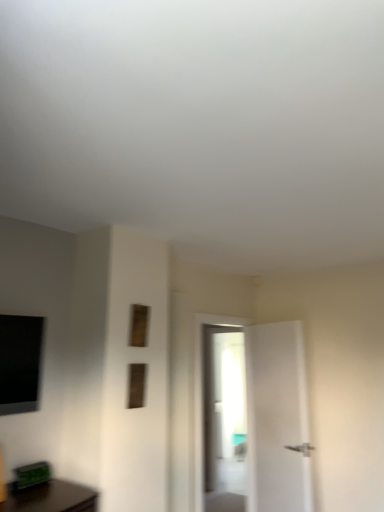
Consider the image. What is the approximate width of wooden frame at center, the 2th window in the top-to-bottom sequence?

wooden frame at center, the 2th window in the top-to-bottom sequence, is 1.12 inches in width.

What are the coordinates of `wooden frame at center, which appears as the 1th window when ordered from the bottom` in the screenshot? It's located at (136, 385).

The width and height of the screenshot is (384, 512). What do you see at coordinates (136, 385) in the screenshot?
I see `wooden frame at center, which appears as the 1th window when ordered from the bottom` at bounding box center [136, 385].

Locate an element on the screen. The image size is (384, 512). wooden frame at upper center, which is the first window from top to bottom is located at coordinates (139, 325).

The height and width of the screenshot is (512, 384). What do you see at coordinates (139, 325) in the screenshot?
I see `wooden frame at upper center, which is the first window from top to bottom` at bounding box center [139, 325].

Where is `wooden frame at center, the 2th window in the top-to-bottom sequence`? Image resolution: width=384 pixels, height=512 pixels. wooden frame at center, the 2th window in the top-to-bottom sequence is located at coordinates (136, 385).

Can you confirm if wooden frame at upper center, which ranks as the 2th window in bottom-to-top order, is positioned to the right of wooden frame at center, which appears as the 1th window when ordered from the bottom?

Incorrect, wooden frame at upper center, which ranks as the 2th window in bottom-to-top order, is not on the right side of wooden frame at center, which appears as the 1th window when ordered from the bottom.

Considering the positions of objects wooden frame at upper center, which ranks as the 2th window in bottom-to-top order, and wooden frame at center, which appears as the 1th window when ordered from the bottom, in the image provided, who is behind, wooden frame at upper center, which ranks as the 2th window in bottom-to-top order, or wooden frame at center, which appears as the 1th window when ordered from the bottom,?

wooden frame at upper center, which ranks as the 2th window in bottom-to-top order, is further away from the camera.

Does point (142, 309) appear closer or farther from the camera than point (130, 401)?

Point (142, 309) appears to be farther away from the viewer than point (130, 401).

From the image's perspective, relative to wooden frame at center, which appears as the 1th window when ordered from the bottom, is wooden frame at upper center, which ranks as the 2th window in bottom-to-top order, above or below?

wooden frame at upper center, which ranks as the 2th window in bottom-to-top order, is situated higher than wooden frame at center, which appears as the 1th window when ordered from the bottom, in the image.

In the scene shown: From a real-world perspective, is wooden frame at upper center, which is the first window from top to bottom, under wooden frame at center, which appears as the 1th window when ordered from the bottom?

No, from a real-world perspective, wooden frame at upper center, which is the first window from top to bottom, is not under wooden frame at center, which appears as the 1th window when ordered from the bottom.

Does wooden frame at upper center, which is the first window from top to bottom, have a greater width compared to wooden frame at center, the 2th window in the top-to-bottom sequence?

In fact, wooden frame at upper center, which is the first window from top to bottom, might be narrower than wooden frame at center, the 2th window in the top-to-bottom sequence.

Can you confirm if wooden frame at upper center, which ranks as the 2th window in bottom-to-top order, is shorter than wooden frame at center, which appears as the 1th window when ordered from the bottom?

Correct, wooden frame at upper center, which ranks as the 2th window in bottom-to-top order, is not as tall as wooden frame at center, which appears as the 1th window when ordered from the bottom.

Looking at this image, considering the relative sizes of wooden frame at upper center, which is the first window from top to bottom, and wooden frame at center, the 2th window in the top-to-bottom sequence, in the image provided, is wooden frame at upper center, which is the first window from top to bottom, smaller than wooden frame at center, the 2th window in the top-to-bottom sequence,?

Yes.

Is wooden frame at center, the 2th window in the top-to-bottom sequence, surrounded by wooden frame at upper center, which is the first window from top to bottom?

That's incorrect, wooden frame at center, the 2th window in the top-to-bottom sequence, is not inside wooden frame at upper center, which is the first window from top to bottom.

Looking at this image, is wooden frame at upper center, which ranks as the 2th window in bottom-to-top order, not close to wooden frame at center, which appears as the 1th window when ordered from the bottom?

wooden frame at upper center, which ranks as the 2th window in bottom-to-top order, is actually quite close to wooden frame at center, which appears as the 1th window when ordered from the bottom.

Is wooden frame at upper center, which is the first window from top to bottom, aimed at wooden frame at center, the 2th window in the top-to-bottom sequence?

No, wooden frame at upper center, which is the first window from top to bottom, is not turned towards wooden frame at center, the 2th window in the top-to-bottom sequence.

What's the angular difference between wooden frame at upper center, which ranks as the 2th window in bottom-to-top order, and wooden frame at center, the 2th window in the top-to-bottom sequence,'s facing directions?

There is a 4.23-degree angle between the facing directions of wooden frame at upper center, which ranks as the 2th window in bottom-to-top order, and wooden frame at center, the 2th window in the top-to-bottom sequence.

How far apart are wooden frame at upper center, which ranks as the 2th window in bottom-to-top order, and wooden frame at center, the 2th window in the top-to-bottom sequence?

8.94 inches.

Identify the location of window behind the wooden frame at center, the 2th window in the top-to-bottom sequence. The image size is (384, 512). (139, 325).

Based on their positions, is wooden frame at center, the 2th window in the top-to-bottom sequence, located to the left or right of wooden frame at upper center, which ranks as the 2th window in bottom-to-top order?

wooden frame at center, the 2th window in the top-to-bottom sequence, is to the right of wooden frame at upper center, which ranks as the 2th window in bottom-to-top order.

Which object is closer to the camera taking this photo, wooden frame at center, which appears as the 1th window when ordered from the bottom, or wooden frame at upper center, which ranks as the 2th window in bottom-to-top order?

wooden frame at center, which appears as the 1th window when ordered from the bottom, is more forward.

Is point (141, 369) positioned in front of point (132, 332)?

No, (141, 369) is behind (132, 332).

From the image's perspective, is wooden frame at center, the 2th window in the top-to-bottom sequence, located above or below wooden frame at upper center, which ranks as the 2th window in bottom-to-top order?

From the image's perspective, wooden frame at center, the 2th window in the top-to-bottom sequence, appears below wooden frame at upper center, which ranks as the 2th window in bottom-to-top order.

From a real-world perspective, is wooden frame at center, the 2th window in the top-to-bottom sequence, physically above wooden frame at upper center, which is the first window from top to bottom?

No, from a real-world perspective, wooden frame at center, the 2th window in the top-to-bottom sequence, is not on top of wooden frame at upper center, which is the first window from top to bottom.

Considering the relative sizes of wooden frame at center, which appears as the 1th window when ordered from the bottom, and wooden frame at upper center, which ranks as the 2th window in bottom-to-top order, in the image provided, is wooden frame at center, which appears as the 1th window when ordered from the bottom, thinner than wooden frame at upper center, which ranks as the 2th window in bottom-to-top order,?

In fact, wooden frame at center, which appears as the 1th window when ordered from the bottom, might be wider than wooden frame at upper center, which ranks as the 2th window in bottom-to-top order.

Does wooden frame at center, which appears as the 1th window when ordered from the bottom, have a lesser height compared to wooden frame at upper center, which is the first window from top to bottom?

No, wooden frame at center, which appears as the 1th window when ordered from the bottom, is not shorter than wooden frame at upper center, which is the first window from top to bottom.

Between wooden frame at center, the 2th window in the top-to-bottom sequence, and wooden frame at upper center, which is the first window from top to bottom, which one has smaller size?

wooden frame at upper center, which is the first window from top to bottom.

Is wooden frame at upper center, which is the first window from top to bottom, completely or partially inside wooden frame at center, the 2th window in the top-to-bottom sequence?

Definitely not — wooden frame at upper center, which is the first window from top to bottom, is not inside wooden frame at center, the 2th window in the top-to-bottom sequence.

Based on the photo, is wooden frame at center, the 2th window in the top-to-bottom sequence, with wooden frame at upper center, which is the first window from top to bottom?

There is a gap between wooden frame at center, the 2th window in the top-to-bottom sequence, and wooden frame at upper center, which is the first window from top to bottom.

Is wooden frame at center, the 2th window in the top-to-bottom sequence, aimed at wooden frame at upper center, which ranks as the 2th window in bottom-to-top order?

No, wooden frame at center, the 2th window in the top-to-bottom sequence, is not facing towards wooden frame at upper center, which ranks as the 2th window in bottom-to-top order.

How different are the orientations of wooden frame at center, which appears as the 1th window when ordered from the bottom, and wooden frame at upper center, which ranks as the 2th window in bottom-to-top order, in degrees?

wooden frame at center, which appears as the 1th window when ordered from the bottom, and wooden frame at upper center, which ranks as the 2th window in bottom-to-top order, are facing 4.23 degrees away from each other.

Locate an element on the screen. Image resolution: width=384 pixels, height=512 pixels. window in front of the wooden frame at upper center, which is the first window from top to bottom is located at coordinates (136, 385).

The image size is (384, 512). Identify the location of window located in front of the wooden frame at upper center, which is the first window from top to bottom. (136, 385).

At what (x,y) coordinates should I click in order to perform the action: click on window on the left of wooden frame at center, the 2th window in the top-to-bottom sequence. Please return your answer as a coordinate pair (x, y). This screenshot has width=384, height=512. Looking at the image, I should click on (139, 325).